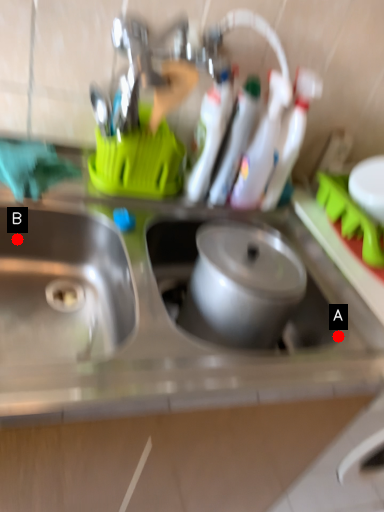
Question: Two points are circled on the image, labeled by A and B beside each circle. Which point is further to the camera?

Choices:
 (A) A is further
 (B) B is further

Answer: (B)